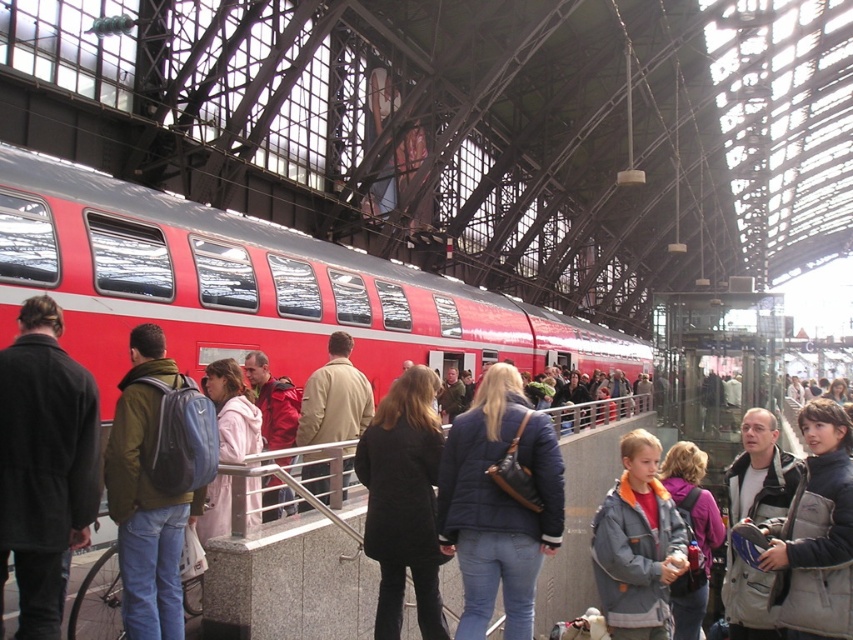
You are a photographer standing on the platform at the train station. You notice two people wearing coats in the scene. The first person is wearing a dark brown wool coat at center, and the second is wearing a beige leather jacket at center. From your vantage point, which coat appears closer to you?

The dark brown wool coat at center is located below the beige leather jacket at center, so the dark brown wool coat at center appears closer to you since it is positioned lower in the scene.

You are a passenger trying to board the red matte train at center. There is a black wool coat at center blocking your path. Can you walk around it without getting too close? Explain your reasoning.

The red matte train at center and black wool coat at center are 7.58 meters apart. Since the distance between them is quite large, you can easily walk around the black wool coat at center while maintaining a safe distance from it.

You are a passenger waiting at the train station. You notice both the red matte train at center and the black wool coat at center. Which object is located to the left of the other?

The black wool coat at center is located to the left of the red matte train at center.